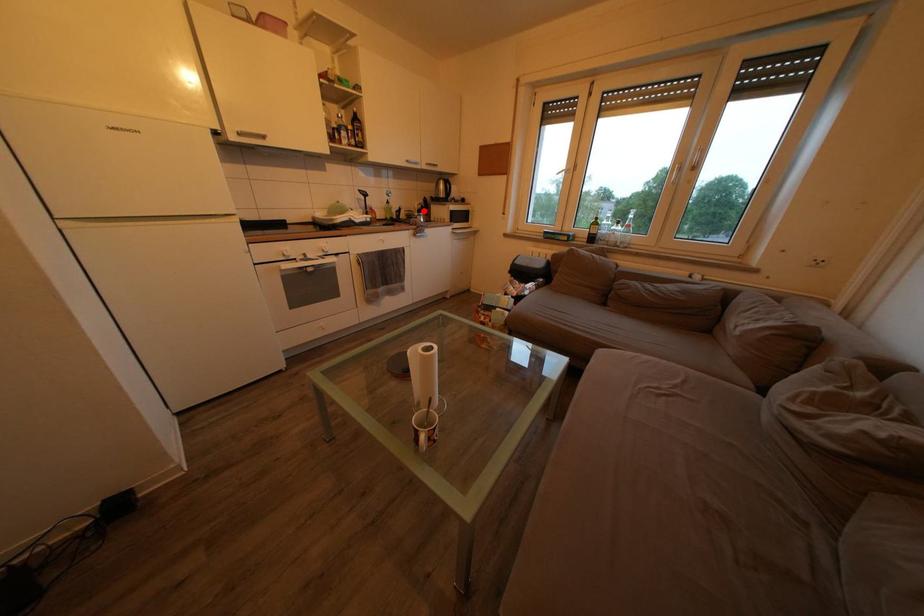
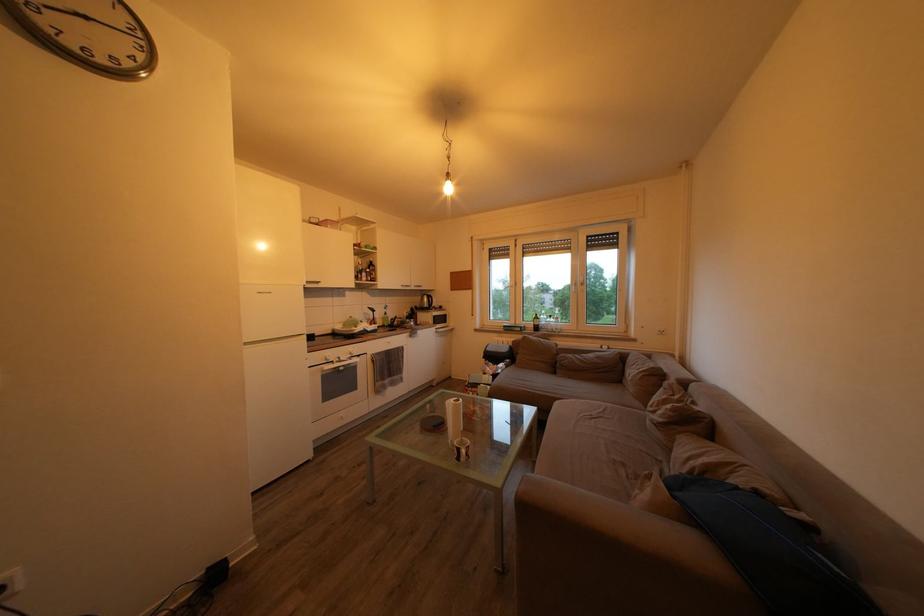
Locate, in the second image, the point that corresponds to the highlighted location in the first image.

(412, 318)